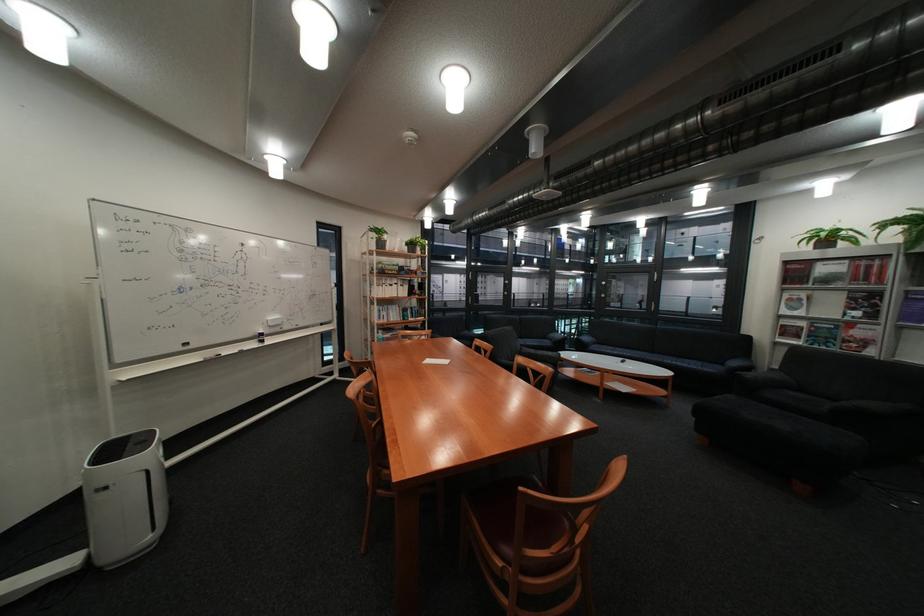
This screenshot has height=616, width=924. Describe the element at coordinates (526, 538) in the screenshot. I see `the chair sitting surface` at that location.